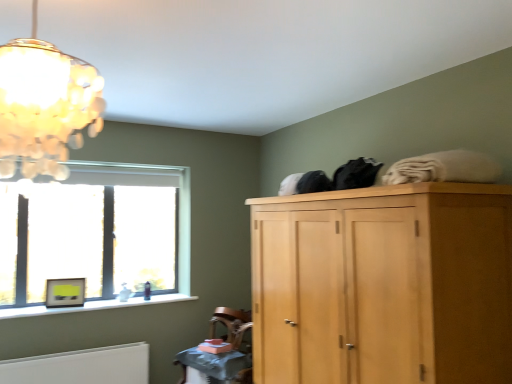
You are a GUI agent. You are given a task and a screenshot of the screen. Output one action in this format:
    pyautogui.click(x=<x>, y=<y>)
    Task: Click on the matte yellow picture frame at window
    The width and height of the screenshot is (512, 384).
    Given the screenshot: What is the action you would take?
    pyautogui.click(x=65, y=292)

This screenshot has height=384, width=512. What do you see at coordinates (45, 105) in the screenshot? I see `translucent glass chandelier at upper left` at bounding box center [45, 105].

Find the location of a particular element. light wood wardrobe at upper right is located at coordinates (384, 285).

Describe the element at coordinates (215, 362) in the screenshot. The height and width of the screenshot is (384, 512). I see `wooden textured table at lower center` at that location.

At what (x,y) coordinates should I click in order to perform the action: click on matte yellow picture frame at window. Please return your answer as a coordinate pair (x, y). The width and height of the screenshot is (512, 384). Looking at the image, I should click on (65, 292).

Can you tell me how much translucent glass chandelier at upper left and black fabric at top differ in facing direction?

175 degrees.

Which object is further away from the camera taking this photo, translucent glass chandelier at upper left or black fabric at top?

black fabric at top is further from the camera.

Which is closer, (x=67, y=83) or (x=376, y=175)?

The point (x=67, y=83) is closer.

From the image's perspective, who appears lower, translucent glass chandelier at upper left or black fabric at top?

black fabric at top.

Is black fabric at top at the left side of clear glass window at left?

In fact, black fabric at top is to the right of clear glass window at left.

In the scene shown: Which of these two, black fabric at top or clear glass window at left, is thinner?

Thinner between the two is clear glass window at left.

From the image's perspective, is black fabric at top located above or below clear glass window at left?

From the image's perspective, black fabric at top appears above clear glass window at left.

Is black fabric at top touching clear glass window at left?

No, black fabric at top is not making contact with clear glass window at left.

Where is `picture frame on the left of clear glass window at left`? This screenshot has height=384, width=512. picture frame on the left of clear glass window at left is located at coordinates (65, 292).

From a real-world perspective, is clear glass window at left physically located above or below matte yellow picture frame at window?

Clearly, from a real-world perspective, clear glass window at left is above matte yellow picture frame at window.

From the picture: Which is farther, (130,255) or (56,299)?

Positioned behind is point (130,255).

Is light wood wardrobe at upper right to the left of wooden textured table at lower center from the viewer's perspective?

Incorrect, light wood wardrobe at upper right is not on the left side of wooden textured table at lower center.

The width and height of the screenshot is (512, 384). What are the coordinates of `cupboard on the right of wooden textured table at lower center` in the screenshot? It's located at (384, 285).

From the image's perspective, is light wood wardrobe at upper right located above or below wooden textured table at lower center?

light wood wardrobe at upper right is situated higher than wooden textured table at lower center in the image.

In terms of height, does light wood wardrobe at upper right look taller or shorter compared to wooden textured table at lower center?

In the image, light wood wardrobe at upper right appears to be taller than wooden textured table at lower center.

Can you confirm if matte yellow picture frame at window is thinner than light wood wardrobe at upper right?

Correct, the width of matte yellow picture frame at window is less than that of light wood wardrobe at upper right.

Is light wood wardrobe at upper right inside matte yellow picture frame at window?

That's incorrect, light wood wardrobe at upper right is not inside matte yellow picture frame at window.

Based on the photo, who is bigger, matte yellow picture frame at window or light wood wardrobe at upper right?

With larger size is light wood wardrobe at upper right.

Is translucent glass chandelier at upper left far away from wooden textured table at lower center?

Yes, translucent glass chandelier at upper left is far from wooden textured table at lower center.

From the image's perspective, is translucent glass chandelier at upper left above or below wooden textured table at lower center?

translucent glass chandelier at upper left is situated higher than wooden textured table at lower center in the image.

Could you tell me if translucent glass chandelier at upper left is facing wooden textured table at lower center?

No, translucent glass chandelier at upper left is not aimed at wooden textured table at lower center.

Which of these two, matte yellow picture frame at window or wooden textured table at lower center, stands taller?

matte yellow picture frame at window is taller.

Identify the location of picture frame on the left of the wooden textured table at lower center. This screenshot has height=384, width=512. (65, 292).

Considering the relative sizes of matte yellow picture frame at window and wooden textured table at lower center in the image provided, is matte yellow picture frame at window wider than wooden textured table at lower center?

Incorrect, the width of matte yellow picture frame at window does not surpass that of wooden textured table at lower center.

Does matte yellow picture frame at window appear on the right side of wooden textured table at lower center?

Incorrect, matte yellow picture frame at window is not on the right side of wooden textured table at lower center.

Find the location of `lamp above the black fabric at top (from the image's perspective)`. lamp above the black fabric at top (from the image's perspective) is located at coordinates (45, 105).

Where is `window on the left of black fabric at top`? window on the left of black fabric at top is located at coordinates (99, 235).

Looking at the image, which one is located further to translucent glass chandelier at upper left, clear glass window at left or black fabric at top?

clear glass window at left is further to translucent glass chandelier at upper left.

From the image, which object appears to be nearer to matte yellow picture frame at window, black fabric at top or light wood wardrobe at upper right?

light wood wardrobe at upper right is positioned closer to the anchor matte yellow picture frame at window.

Which object lies further to the anchor point translucent glass chandelier at upper left, matte yellow picture frame at window or wooden textured table at lower center?

The object further to translucent glass chandelier at upper left is matte yellow picture frame at window.

Considering their positions, is clear glass window at left positioned closer to matte yellow picture frame at window than light wood wardrobe at upper right?

The object closer to matte yellow picture frame at window is clear glass window at left.

Looking at the image, which one is located further to light wood wardrobe at upper right, black fabric at top or matte yellow picture frame at window?

matte yellow picture frame at window is further to light wood wardrobe at upper right.

Which object lies further to the anchor point translucent glass chandelier at upper left, black fabric at top or clear glass window at left?

clear glass window at left is further to translucent glass chandelier at upper left.

Based on their spatial positions, is wooden textured table at lower center or clear glass window at left further from black fabric at top?

clear glass window at left is further to black fabric at top.

Based on their spatial positions, is light wood wardrobe at upper right or clear glass window at left closer to translucent glass chandelier at upper left?

The object closer to translucent glass chandelier at upper left is light wood wardrobe at upper right.

Where is `table between clear glass window at left and black fabric at top in the horizontal direction`? The image size is (512, 384). table between clear glass window at left and black fabric at top in the horizontal direction is located at coordinates (215, 362).

At what (x,y) coordinates should I click in order to perform the action: click on table located between matte yellow picture frame at window and black fabric at top in the left-right direction. Please return your answer as a coordinate pair (x, y). This screenshot has height=384, width=512. Looking at the image, I should click on (215, 362).

Where is `clothing positioned between translucent glass chandelier at upper left and matte yellow picture frame at window from near to far`? Image resolution: width=512 pixels, height=384 pixels. clothing positioned between translucent glass chandelier at upper left and matte yellow picture frame at window from near to far is located at coordinates (356, 174).

Where is `clothing situated between clear glass window at left and light wood wardrobe at upper right from left to right`? The image size is (512, 384). clothing situated between clear glass window at left and light wood wardrobe at upper right from left to right is located at coordinates (356, 174).